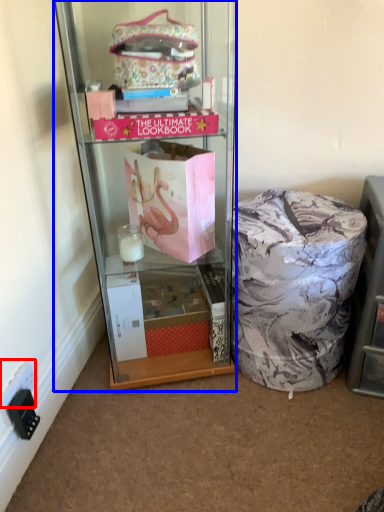
Question: Which object appears farthest to the camera in this image, power outlet (highlighted by a red box) or cabinetry (highlighted by a blue box)?

Choices:
 (A) power outlet
 (B) cabinetry

Answer: (A)